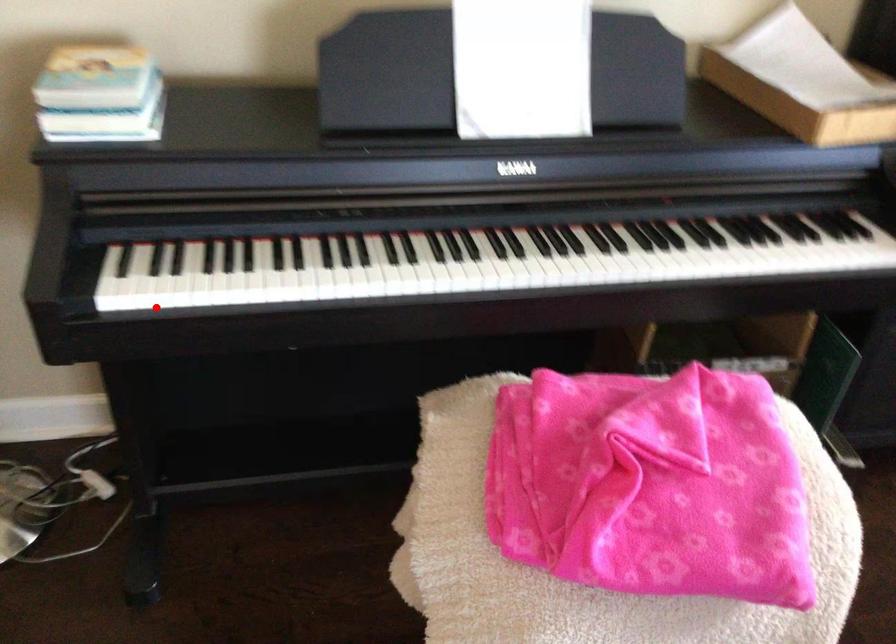
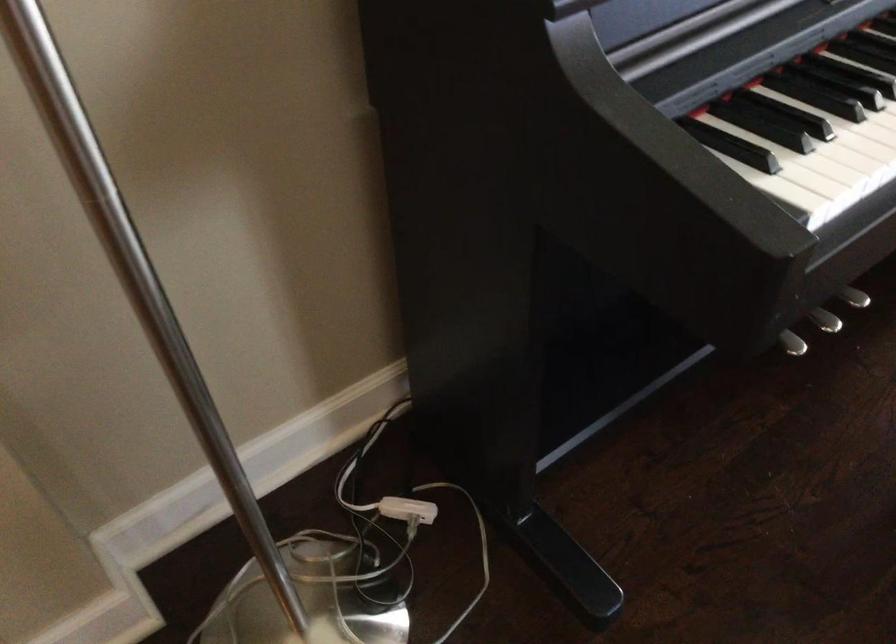
Where in the second image is the point corresponding to the highlighted location from the first image?

(851, 196)